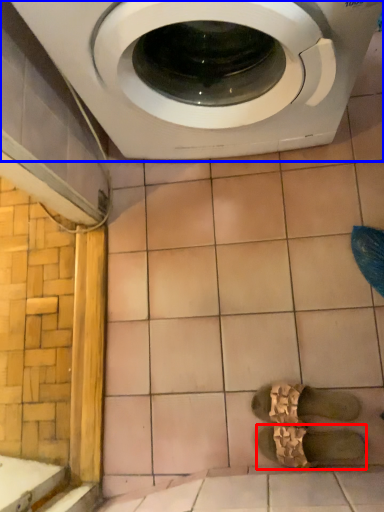
Question: Which point is further to the camera, shoe (highlighted by a red box) or washing machine (highlighted by a blue box)?

Choices:
 (A) shoe
 (B) washing machine

Answer: (A)